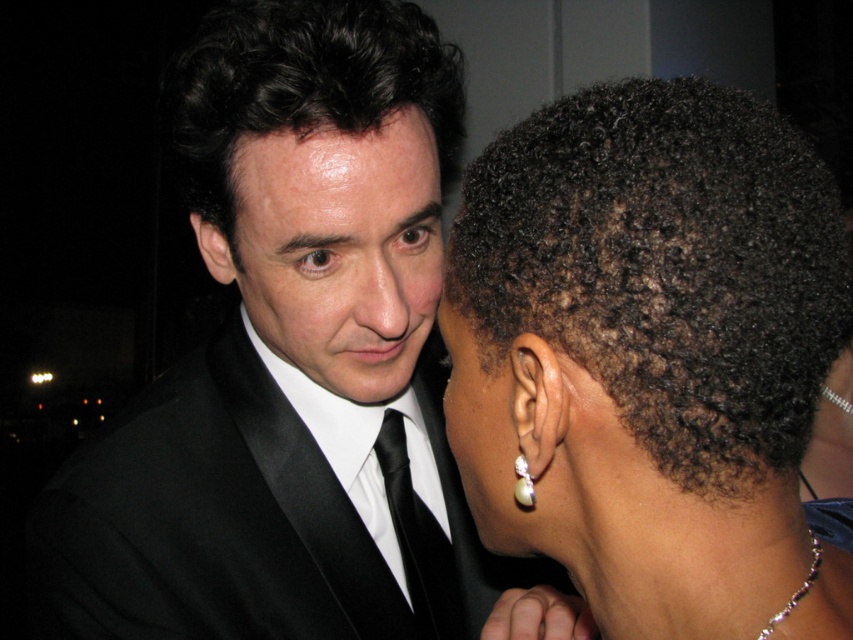
Can you confirm if black satin suit at center is positioned above smooth black suit at center?

No, black satin suit at center is not above smooth black suit at center.

Measure the distance between black satin suit at center and smooth black suit at center.

black satin suit at center is 2.10 inches from smooth black suit at center.

This screenshot has width=853, height=640. I want to click on black satin suit at center, so (x=285, y=355).

Which of these two, pearl earring at right or black satin tie at center, stands taller?

black satin tie at center is taller.

Does pearl earring at right appear under black satin tie at center?

Actually, pearl earring at right is above black satin tie at center.

Who is more forward, [479,429] or [393,426]?

Positioned in front is point [479,429].

You are a GUI agent. You are given a task and a screenshot of the screen. Output one action in this format:
    pyautogui.click(x=<x>, y=<y>)
    Task: Click on the pearl earring at right
    This screenshot has width=853, height=640.
    Given the screenshot: What is the action you would take?
    pyautogui.click(x=486, y=426)

Identify the location of black silk suit at center. The height and width of the screenshot is (640, 853). click(x=207, y=520).

I want to click on black silk suit at center, so click(x=207, y=520).